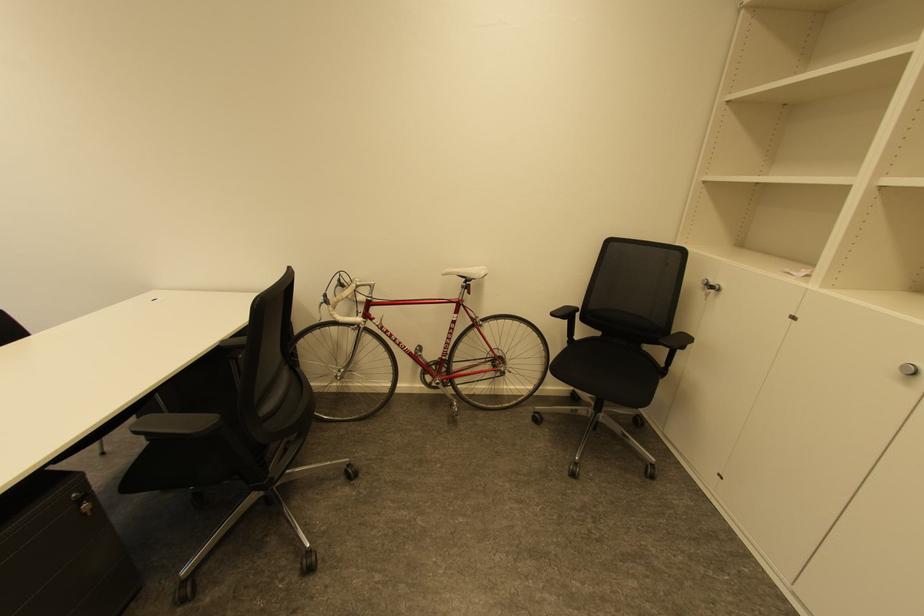
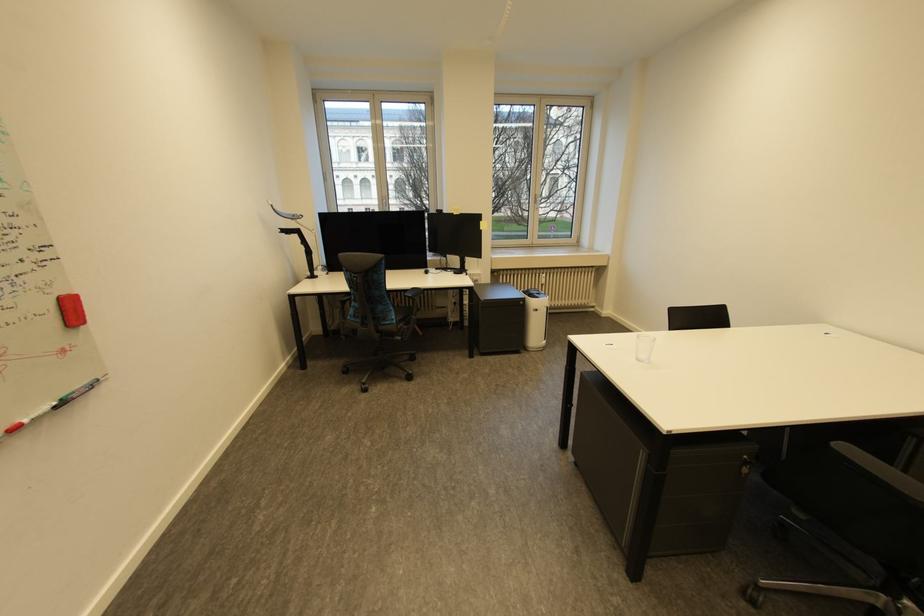
Locate, in the second image, the point that corresponds to point (81, 495) in the first image.

(752, 456)